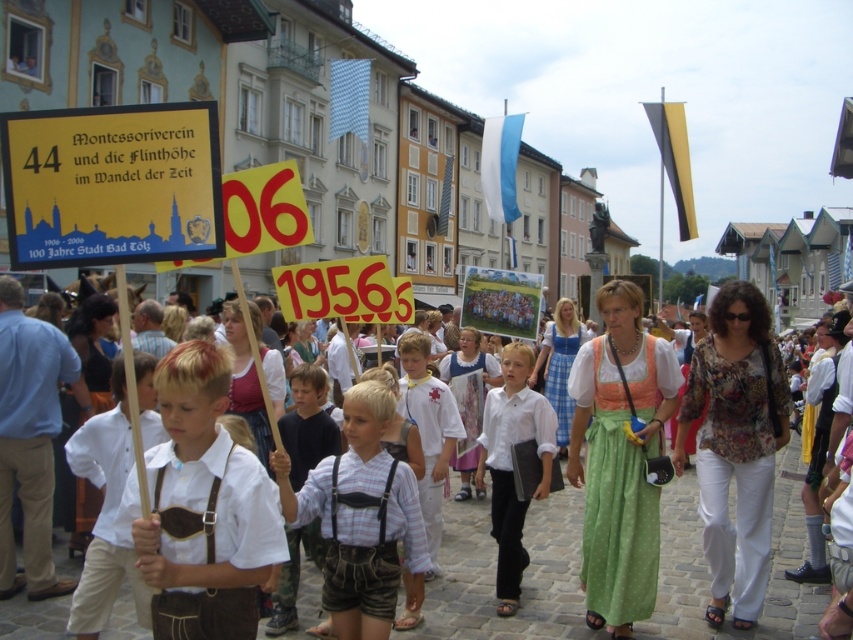
You are a photographer trying to capture both the white striped shirt at center and the white cotton shirt at center in a single shot. Since the camera has a limited depth of field, you need to focus on the narrower object first. Which shirt should you focus on?

The white striped shirt at center is thinner than the white cotton shirt at center, so you should focus on the white striped shirt at center first because it is narrower and requires precise focus to ensure clarity.